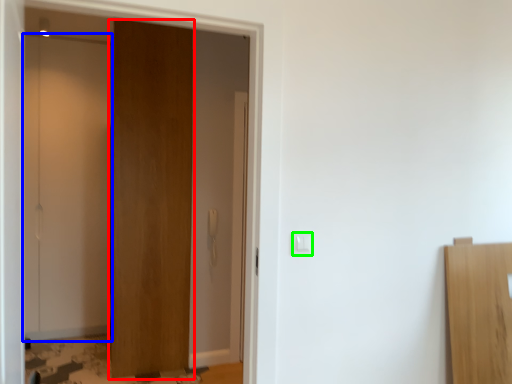
Question: Which is farther away from door (highlighted by a red box)? door (highlighted by a blue box) or light switch (highlighted by a green box)?

Choices:
 (A) door
 (B) light switch

Answer: (B)